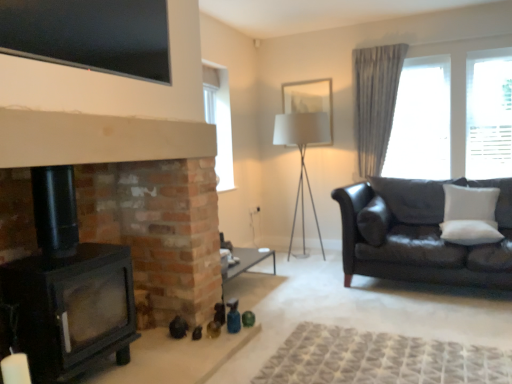
Question: Can you confirm if white fabric picture frame at upper center is positioned to the left of black glass tv at upper center?

Choices:
 (A) yes
 (B) no

Answer: (B)

Question: Can you confirm if white fabric picture frame at upper center is smaller than black glass tv at upper center?

Choices:
 (A) no
 (B) yes

Answer: (A)

Question: Considering the relative sizes of white fabric picture frame at upper center and black glass tv at upper center in the image provided, is white fabric picture frame at upper center bigger than black glass tv at upper center?

Choices:
 (A) yes
 (B) no

Answer: (A)

Question: Is black glass tv at upper center surrounded by white fabric picture frame at upper center?

Choices:
 (A) yes
 (B) no

Answer: (B)

Question: Are white fabric picture frame at upper center and black glass tv at upper center far apart?

Choices:
 (A) yes
 (B) no

Answer: (A)

Question: Considering the relative sizes of white fabric picture frame at upper center and black glass tv at upper center in the image provided, is white fabric picture frame at upper center wider than black glass tv at upper center?

Choices:
 (A) yes
 (B) no

Answer: (A)

Question: From the image's perspective, is white soft cushion at right, the 1th pillow in the back-to-front sequence, below gray fabric curtain at upper right?

Choices:
 (A) yes
 (B) no

Answer: (A)

Question: Is white soft cushion at right, the 1th pillow in the back-to-front sequence, thinner than gray fabric curtain at upper right?

Choices:
 (A) yes
 (B) no

Answer: (A)

Question: Is white soft cushion at right, placed as the 2th pillow when sorted from front to back, next to gray fabric curtain at upper right?

Choices:
 (A) yes
 (B) no

Answer: (B)

Question: Does white soft cushion at right, placed as the 2th pillow when sorted from front to back, appear on the left side of gray fabric curtain at upper right?

Choices:
 (A) yes
 (B) no

Answer: (B)

Question: Is white soft cushion at right, placed as the 2th pillow when sorted from front to back, outside of gray fabric curtain at upper right?

Choices:
 (A) yes
 (B) no

Answer: (A)

Question: Does white soft cushion at right, placed as the 2th pillow when sorted from front to back, have a greater width compared to gray fabric curtain at upper right?

Choices:
 (A) yes
 (B) no

Answer: (B)

Question: Can you confirm if sheer fabric curtain at right is bigger than black glass tv at upper center?

Choices:
 (A) yes
 (B) no

Answer: (A)